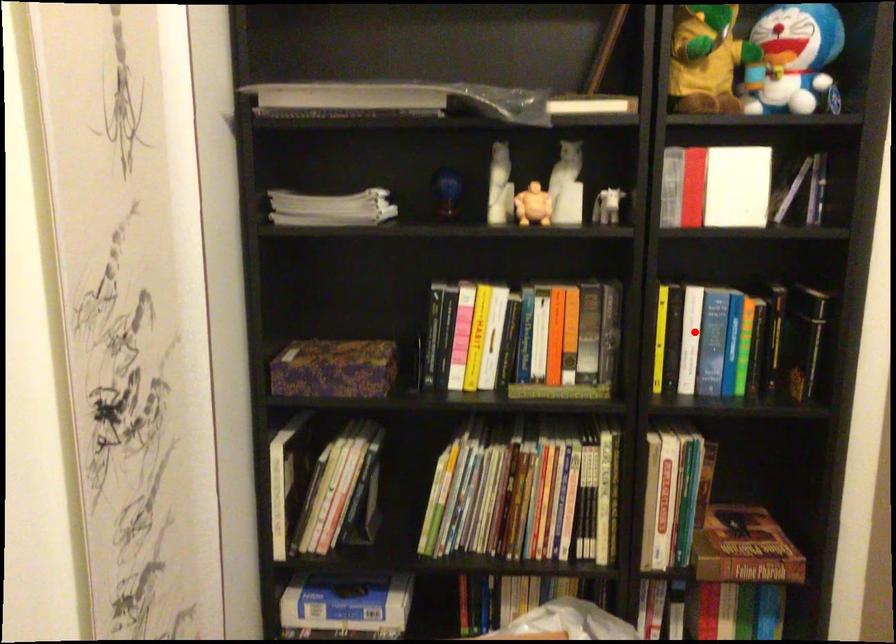
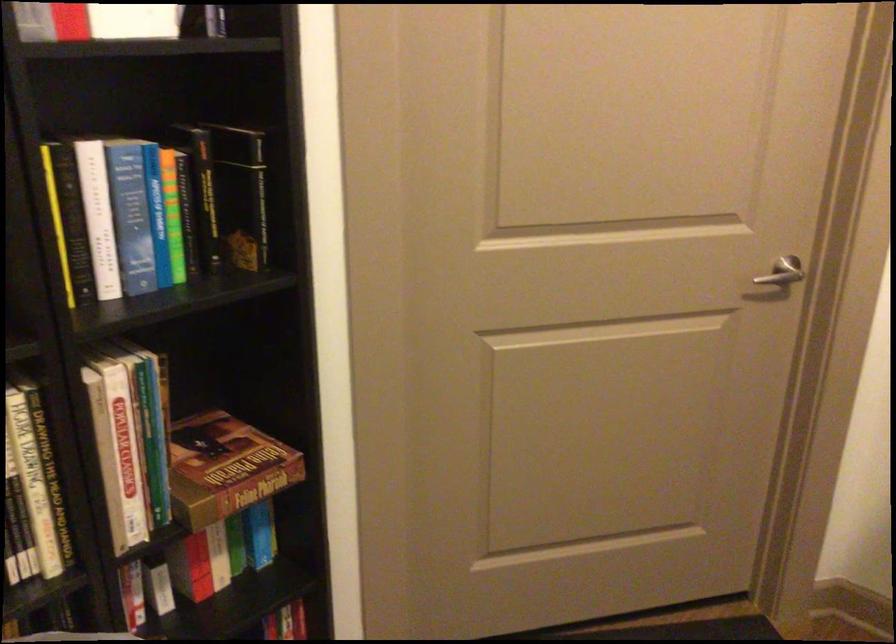
Question: A red point is marked in image1. In image2, is the corresponding 3D point closer to the camera or farther? Reply with the corresponding letter.

Choices:
 (A) The corresponding 3D point is closer.
 (B) The corresponding 3D point is farther.

Answer: (A)